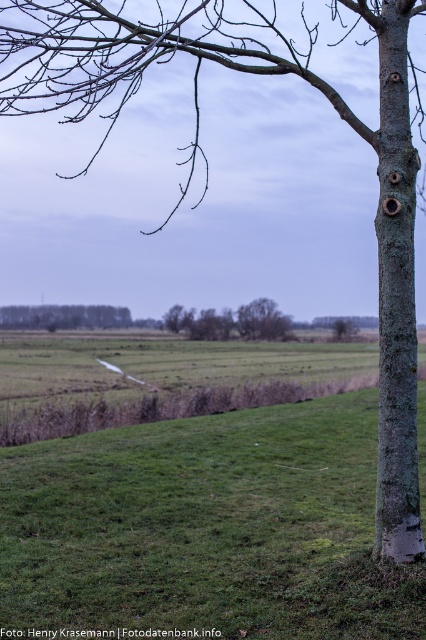
Question: Can you confirm if brown rough tree at center is smaller than green grassy field at lower left?

Choices:
 (A) yes
 (B) no

Answer: (B)

Question: Based on their relative distances, which object is nearer to the green mossy bark tree trunk at right?

Choices:
 (A) brown rough tree at center
 (B) green grassy field at lower left

Answer: (A)

Question: Which of the following is the farthest from the observer?

Choices:
 (A) coord(193,323)
 (B) coord(394,218)
 (C) coord(9,307)

Answer: (C)

Question: Where is brown rough tree at center located in relation to green grassy field at lower left in the image?

Choices:
 (A) left
 (B) right

Answer: (B)

Question: Is green mossy bark tree trunk at right below brown rough tree at center?

Choices:
 (A) no
 (B) yes

Answer: (B)

Question: Which of the following is the closest to the observer?

Choices:
 (A) (100, 307)
 (B) (186, 312)

Answer: (B)